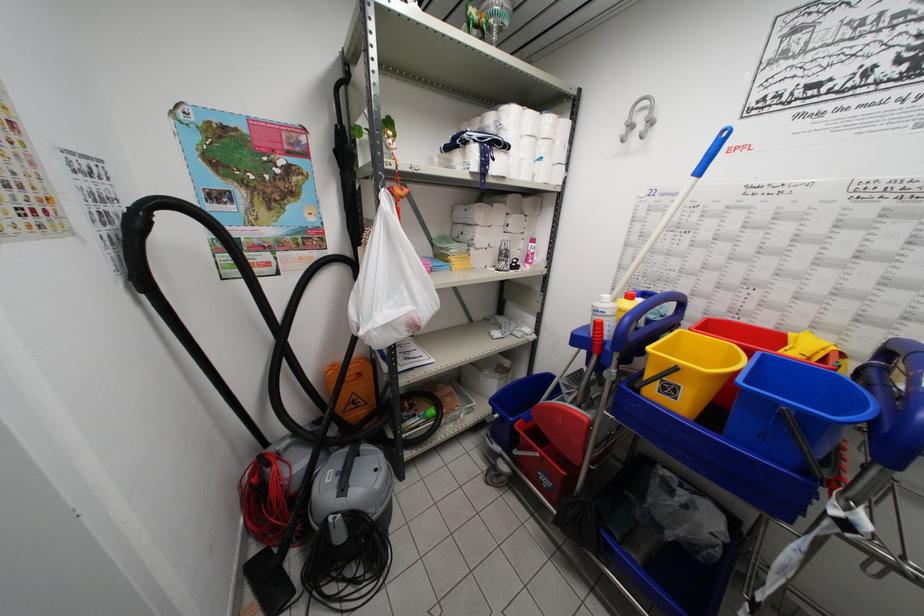
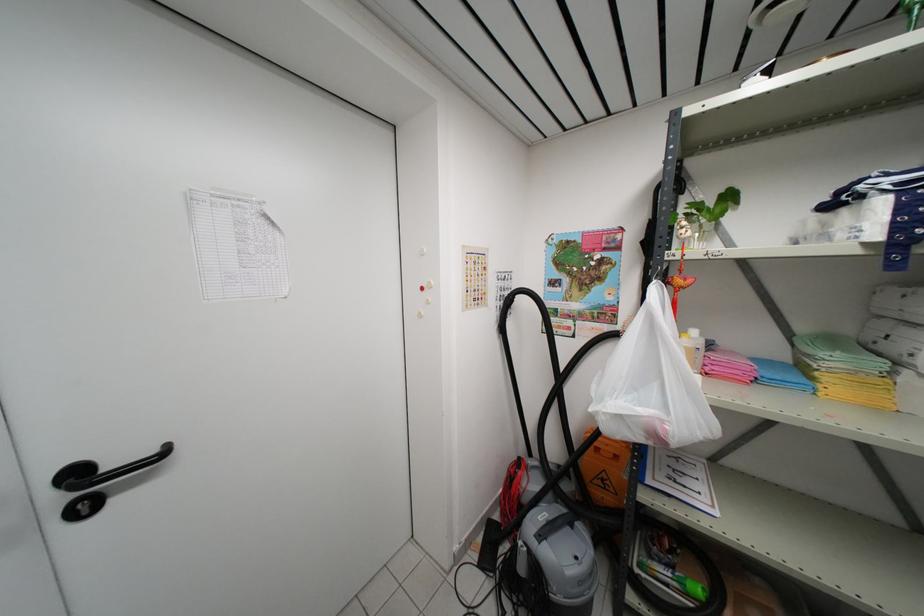
Locate, in the second image, the point that corresponds to point (421, 323) in the first image.

(670, 435)